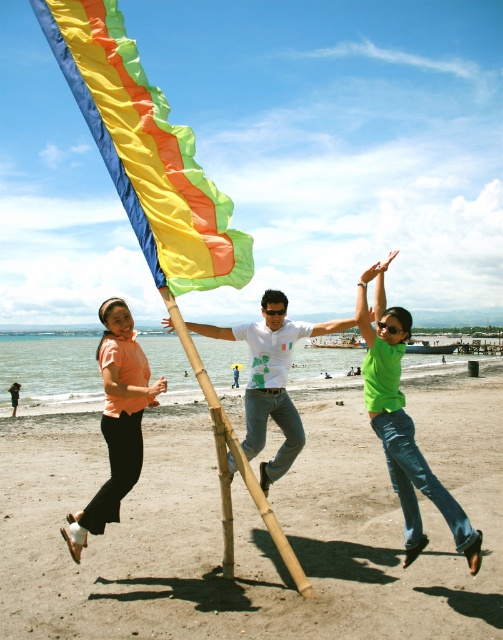
Question: Considering the relative positions of multicolored fabric flag at center and white printed t-shirt at center in the image provided, where is multicolored fabric flag at center located with respect to white printed t-shirt at center?

Choices:
 (A) below
 (B) above

Answer: (B)

Question: Which of the following is the closest to the observer?

Choices:
 (A) (379, 339)
 (B) (346, 552)

Answer: (A)

Question: Which object is positioned closest to the white printed t-shirt at center?

Choices:
 (A) multicolored fabric flag at center
 (B) matte peach blouse at left
 (C) green matte shirt at center
 (D) sandy beach at lower center

Answer: (C)

Question: Among these points, which one is nearest to the camera?

Choices:
 (A) (128, 483)
 (B) (337, 324)
 (C) (157, 234)
 (D) (15, 456)

Answer: (A)

Question: Where is multicolored fabric flag at center located in relation to green matte shirt at center in the image?

Choices:
 (A) above
 (B) below

Answer: (A)

Question: Can you confirm if sandy beach at lower center is positioned above green matte shirt at center?

Choices:
 (A) no
 (B) yes

Answer: (A)